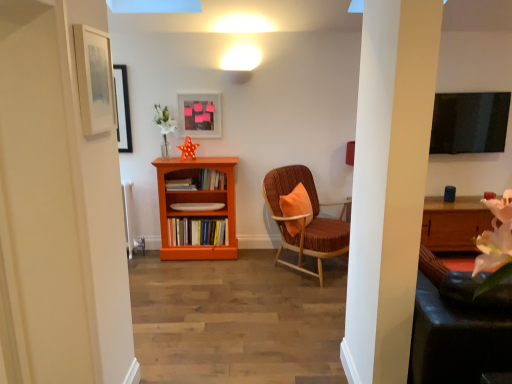
The image size is (512, 384). Describe the element at coordinates (303, 220) in the screenshot. I see `velvet brown chair with orange cushion at center` at that location.

Where is `matte plastic picture frame at upper center, the 1th picture frame when ordered from right to left`? This screenshot has height=384, width=512. matte plastic picture frame at upper center, the 1th picture frame when ordered from right to left is located at coordinates (199, 115).

Describe the element at coordinates (196, 201) in the screenshot. This screenshot has width=512, height=384. I see `orange wood bookshelf at center` at that location.

The image size is (512, 384). I want to click on hardcover books at center, which ranks as the 1th book in bottom-to-top order, so click(x=197, y=231).

Describe the element at coordinates (212, 180) in the screenshot. I see `wooden bookshelf at center, the 1th book from the top` at that location.

Identify the location of matte white picture frame at upper left, the first picture frame in the left-to-right sequence. The width and height of the screenshot is (512, 384). (94, 80).

Considering the positions of objects orange wood bookshelf at center and hardcover books at center, the 3th book from the top, in the image provided, who is more to the right, orange wood bookshelf at center or hardcover books at center, the 3th book from the top,?

Result: hardcover books at center, the 3th book from the top, is more to the right.

Considering the relative sizes of orange wood bookshelf at center and hardcover books at center, the 3th book from the top, in the image provided, is orange wood bookshelf at center bigger than hardcover books at center, the 3th book from the top,?

Yes.

Consider the image. Could hardcover books at center, which ranks as the 1th book in bottom-to-top order, be considered to be inside orange wood bookshelf at center?

Absolutely, hardcover books at center, which ranks as the 1th book in bottom-to-top order, is inside orange wood bookshelf at center.

Is velvet orange swivel chair at right turned away from wooden bookshelf at center, the 1th book from the top?

No, wooden bookshelf at center, the 1th book from the top, is not at the back of velvet orange swivel chair at right.

Is velvet orange swivel chair at right not inside wooden bookshelf at center, the 1th book from the top?

Yes, velvet orange swivel chair at right is located beyond the bounds of wooden bookshelf at center, the 1th book from the top.

Does point (417, 312) appear closer or farther from the camera than point (205, 173)?

Point (417, 312) appears to be closer to the viewer than point (205, 173).

Considering the sizes of velvet orange swivel chair at right and wooden bookshelf at center, the 1th book from the top, in the image, is velvet orange swivel chair at right wider or thinner than wooden bookshelf at center, the 1th book from the top,?

Considering their sizes, velvet orange swivel chair at right looks broader than wooden bookshelf at center, the 1th book from the top.

From the picture: Would you say orange wood bookshelf at center is part of velvet brown chair with orange cushion at center's contents?

Actually, orange wood bookshelf at center is outside velvet brown chair with orange cushion at center.

Which of these two, velvet brown chair with orange cushion at center or orange wood bookshelf at center, is bigger?

velvet brown chair with orange cushion at center is bigger.

Considering the sizes of velvet brown chair with orange cushion at center and orange wood bookshelf at center in the image, is velvet brown chair with orange cushion at center taller or shorter than orange wood bookshelf at center?

In the image, velvet brown chair with orange cushion at center appears to be shorter than orange wood bookshelf at center.

From a real-world perspective, is velvet brown chair with orange cushion at center above or below orange wood bookshelf at center?

In terms of real-world spatial position, velvet brown chair with orange cushion at center is below orange wood bookshelf at center.

Is matte plastic picture frame at upper center, which is counted as the second picture frame, starting from the front, at the back of velvet orange swivel chair at right?

That's not correct — velvet orange swivel chair at right is not looking away from matte plastic picture frame at upper center, which is counted as the second picture frame, starting from the front.

Is velvet orange swivel chair at right placed right next to matte plastic picture frame at upper center, which appears as the 1th picture frame when viewed from the back?

No, velvet orange swivel chair at right is not in contact with matte plastic picture frame at upper center, which appears as the 1th picture frame when viewed from the back.

How many degrees apart are the facing directions of velvet orange swivel chair at right and matte plastic picture frame at upper center, which appears as the second picture frame when viewed from the left?

The facing directions of velvet orange swivel chair at right and matte plastic picture frame at upper center, which appears as the second picture frame when viewed from the left, are 179 degrees apart.

Which is less distant, (465, 318) or (195, 114)?

Point (465, 318) is positioned closer to the camera compared to point (195, 114).

Does point (326, 222) come behind point (210, 178)?

No, it is not.

Between velvet brown chair with orange cushion at center and wooden bookshelf at center, the third book in the bottom-to-top sequence, which one is positioned behind?

Positioned behind is wooden bookshelf at center, the third book in the bottom-to-top sequence.

Is velvet brown chair with orange cushion at center wider than wooden bookshelf at center, the 1th book from the top?

Yes.

Can you tell me how much velvet brown chair with orange cushion at center and wooden bookshelf at center, the third book in the bottom-to-top sequence, differ in facing direction?

The angular difference between velvet brown chair with orange cushion at center and wooden bookshelf at center, the third book in the bottom-to-top sequence, is 44.7 degrees.

How much distance is there between wooden bookshelf at center, the third book in the bottom-to-top sequence, and matte plastic picture frame at upper center, which appears as the second picture frame when viewed from the left?

wooden bookshelf at center, the third book in the bottom-to-top sequence, and matte plastic picture frame at upper center, which appears as the second picture frame when viewed from the left, are 20.82 inches apart from each other.

Is wooden bookshelf at center, the 1th book from the top, not near matte plastic picture frame at upper center, the 1th picture frame when ordered from right to left?

No, wooden bookshelf at center, the 1th book from the top, is not far from matte plastic picture frame at upper center, the 1th picture frame when ordered from right to left.

From a real-world perspective, between wooden bookshelf at center, the third book in the bottom-to-top sequence, and matte plastic picture frame at upper center, the 1th picture frame when ordered from right to left, who is vertically higher?

In real-world perspective, matte plastic picture frame at upper center, the 1th picture frame when ordered from right to left, is above.

From the image's perspective, is wooden bookshelf at center, the 1th book from the top, on top of matte plastic picture frame at upper center, the 1th picture frame when ordered from right to left?

No.

Can you see velvet brown chair with orange cushion at center touching hardcover books at center, the 3th book from the top?

No, velvet brown chair with orange cushion at center is not touching hardcover books at center, the 3th book from the top.

From a real-world perspective, between velvet brown chair with orange cushion at center and hardcover books at center, which ranks as the 1th book in bottom-to-top order, who is vertically lower?

From a 3D spatial view, hardcover books at center, which ranks as the 1th book in bottom-to-top order, is below.

The height and width of the screenshot is (384, 512). What are the coordinates of `the 2nd book counting from the left of the velvet brown chair with orange cushion at center` in the screenshot? It's located at (197, 231).

In the scene shown: Would you say velvet brown chair with orange cushion at center is inside or outside hardcover books at center, the 3th book from the top?

The correct answer is: outside.

You are a GUI agent. You are given a task and a screenshot of the screen. Output one action in this format:
    pyautogui.click(x=<x>, y=<y>)
    Task: Click on the 3rd book behind when counting from the orange wood bookshelf at center
    The width and height of the screenshot is (512, 384).
    Given the screenshot: What is the action you would take?
    pyautogui.click(x=197, y=231)

You are a GUI agent. You are given a task and a screenshot of the screen. Output one action in this format:
    pyautogui.click(x=<x>, y=<y>)
    Task: Click on the swivel chair to the right of wooden bookshelf at center, the 1th book from the top
    The width and height of the screenshot is (512, 384).
    Given the screenshot: What is the action you would take?
    pyautogui.click(x=455, y=329)

Looking at the image, which one is located further to wooden bookshelf at center, the third book in the bottom-to-top sequence, hardcover books at center, the 3th book from the top, or velvet brown chair with orange cushion at center?

The object further to wooden bookshelf at center, the third book in the bottom-to-top sequence, is velvet brown chair with orange cushion at center.

Considering their positions, is hardcover books at center, the 3th book from the top, positioned further to wooden bookshelf at center, the third book in the bottom-to-top sequence, than wooden bookshelf at center, which ranks as the second book in bottom-to-top order?

hardcover books at center, the 3th book from the top.

From the image, which object appears to be farther from velvet brown chair with orange cushion at center, orange wood bookshelf at center or velvet orange swivel chair at right?

velvet orange swivel chair at right lies further to velvet brown chair with orange cushion at center than the other object.

Considering their positions, is wooden bookshelf at center, which ranks as the second book in bottom-to-top order, positioned further to wooden bookshelf at center, the third book in the bottom-to-top sequence, than orange wood bookshelf at center?

orange wood bookshelf at center is positioned further to the anchor wooden bookshelf at center, the third book in the bottom-to-top sequence.

Which object lies further to the anchor point orange wood bookshelf at center, wooden bookshelf at center, the 2th book viewed from the top, or velvet brown chair with orange cushion at center?

Based on the image, velvet brown chair with orange cushion at center appears to be further to orange wood bookshelf at center.

From the image, which object appears to be nearer to matte white picture frame at upper left, which is the second picture frame from back to front, velvet orange swivel chair at right or wooden bookshelf at center, the third book in the bottom-to-top sequence?

velvet orange swivel chair at right is positioned closer to the anchor matte white picture frame at upper left, which is the second picture frame from back to front.

Looking at the image, which one is located closer to matte white picture frame at upper left, the first picture frame in the left-to-right sequence, orange wood bookshelf at center or matte plastic picture frame at upper center, which is counted as the second picture frame, starting from the front?

The object closer to matte white picture frame at upper left, the first picture frame in the left-to-right sequence, is orange wood bookshelf at center.

When comparing their distances from matte white picture frame at upper left, which is the second picture frame from back to front, does velvet orange swivel chair at right or velvet brown chair with orange cushion at center seem further?

The object further to matte white picture frame at upper left, which is the second picture frame from back to front, is velvet brown chair with orange cushion at center.

Identify the location of book that lies between wooden bookshelf at center, the 1th book from the top, and orange wood bookshelf at center from top to bottom. (180, 185).

The width and height of the screenshot is (512, 384). I want to click on chair positioned between matte white picture frame at upper left, acting as the first picture frame starting from the front, and orange wood bookshelf at center from near to far, so click(x=303, y=220).

The image size is (512, 384). What are the coordinates of `book between matte plastic picture frame at upper center, which is counted as the second picture frame, starting from the front, and velvet brown chair with orange cushion at center, in the horizontal direction` in the screenshot? It's located at (212, 180).

At what (x,y) coordinates should I click in order to perform the action: click on shelf between matte white picture frame at upper left, the 2th picture frame from the right, and wooden bookshelf at center, the 1th book from the top, from front to back. Please return your answer as a coordinate pair (x, y). The height and width of the screenshot is (384, 512). Looking at the image, I should click on click(x=196, y=201).